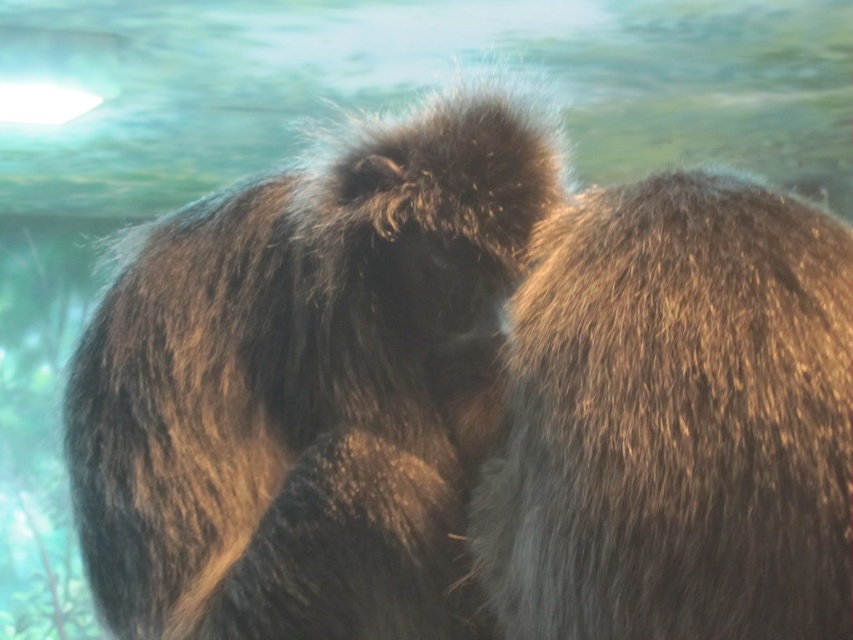
You are observing two monkeys grooming each other in a forest. There is a point at coordinates point (309, 387). Can you tell me what this point corresponds to?

The point (309, 387) corresponds to the brown fuzzy fur at center.

You are an animal behaviorist observing two monkeys in a grooming session. You notice two distinct patches of fur in the image. The first is a brown fuzzy fur at center, and the second is a fuzzy brown fur at upper right. Which of these fur patches is bigger in the image?

The brown fuzzy fur at center is larger in size than the fuzzy brown fur at upper right, so the brown fuzzy fur at center is bigger.

In the image of two monkeys grooming, there are two areas of fur visible. One is labeled as brown fuzzy fur at center and the other as fuzzy brown fur at upper right. Which of these two furs is positioned lower in the image?

The brown fuzzy fur at center is positioned below the fuzzy brown fur at upper right, so the brown fuzzy fur at center is lower in the image.